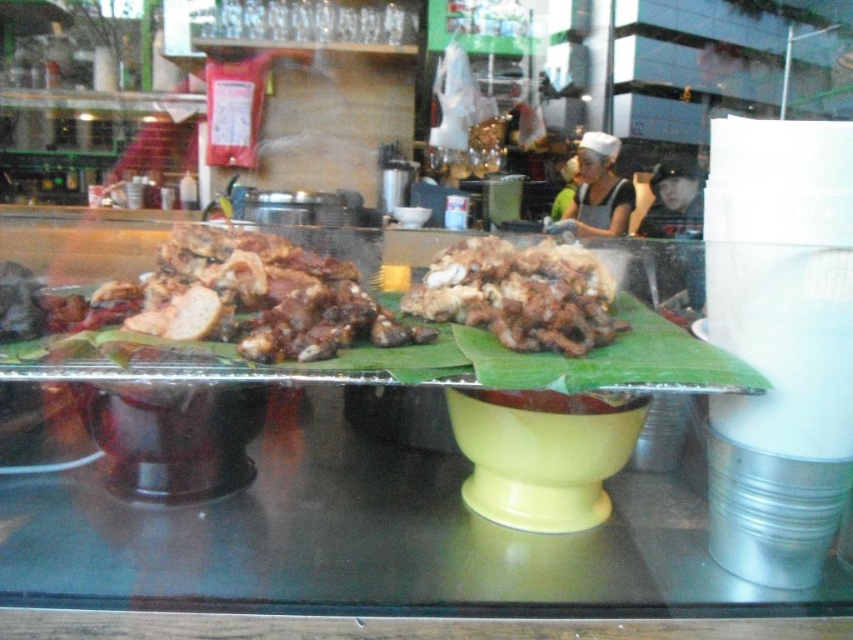
Is brown matte meat at center to the right of brown crispy meat at center from the viewer's perspective?

Incorrect, brown matte meat at center is not on the right side of brown crispy meat at center.

Who is shorter, brown matte meat at center or brown crispy meat at center?

brown crispy meat at center

Who is more forward, (277, 280) or (563, 280)?

Point (563, 280) is more forward.

You are a GUI agent. You are given a task and a screenshot of the screen. Output one action in this format:
    pyautogui.click(x=<x>, y=<y>)
    Task: Click on the brown matte meat at center
    
    Given the screenshot: What is the action you would take?
    pyautogui.click(x=256, y=298)